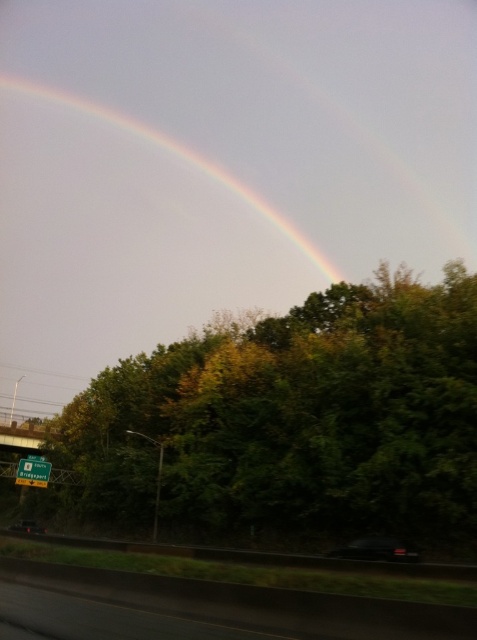
You are an artist trying to paint the scene. You want to ensure the green leafy tree at upper center and the rainbow at upper center are positioned correctly. According to the scene description, which object should be placed lower in your painting?

The green leafy tree at upper center should be placed lower than the rainbow at upper center because the green leafy tree at upper center is located below rainbow at upper center in the scene.

You are standing on the ground and looking at the green leafy tree at upper center and the rainbow at upper center. Which object is closer to you?

The green leafy tree at upper center is closer to you than the rainbow at upper center because they are 391.04 feet apart.

You are an astronomer observing the sky and want to locate the rainbow at upper center. What are the coordinates where you should direct your telescope?

The rainbow at upper center is located at coordinates point (173, 156).